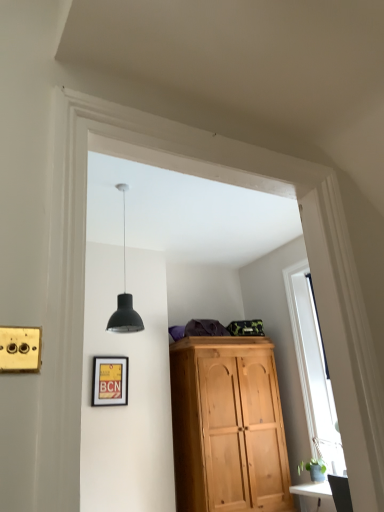
Question: From a real-world perspective, relative to matte black lampshade at center, is transparent glass window at right vertically above or below?

Choices:
 (A) above
 (B) below

Answer: (B)

Question: Is point (322, 356) closer or farther from the camera than point (117, 295)?

Choices:
 (A) closer
 (B) farther

Answer: (B)

Question: Based on their relative distances, which object is farther from the matte black lampshade at center?

Choices:
 (A) matte yellow picture frame at lower left
 (B) transparent glass window at right

Answer: (B)

Question: Considering the real-world distances, which object is closest to the transparent glass window at right?

Choices:
 (A) matte yellow picture frame at lower left
 (B) matte black lampshade at center

Answer: (A)